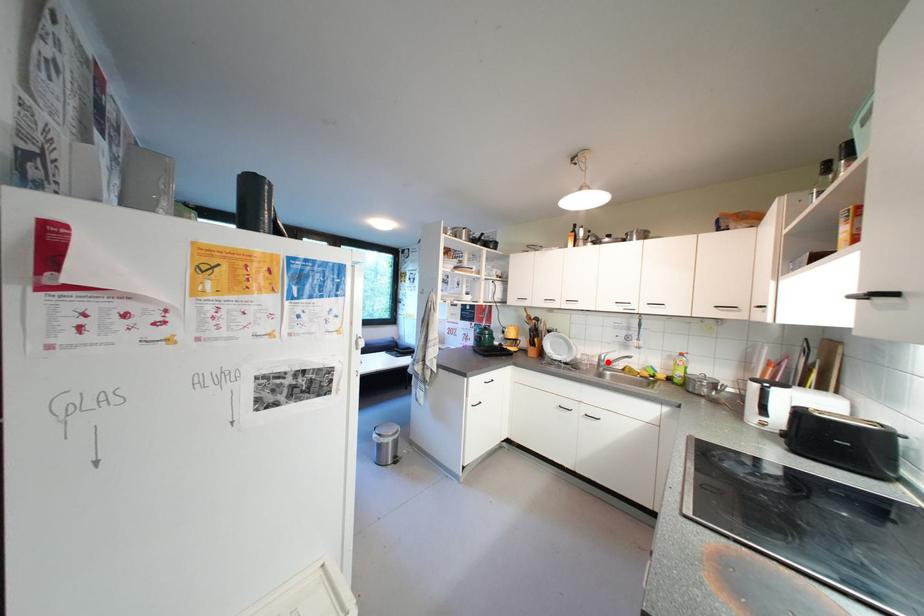
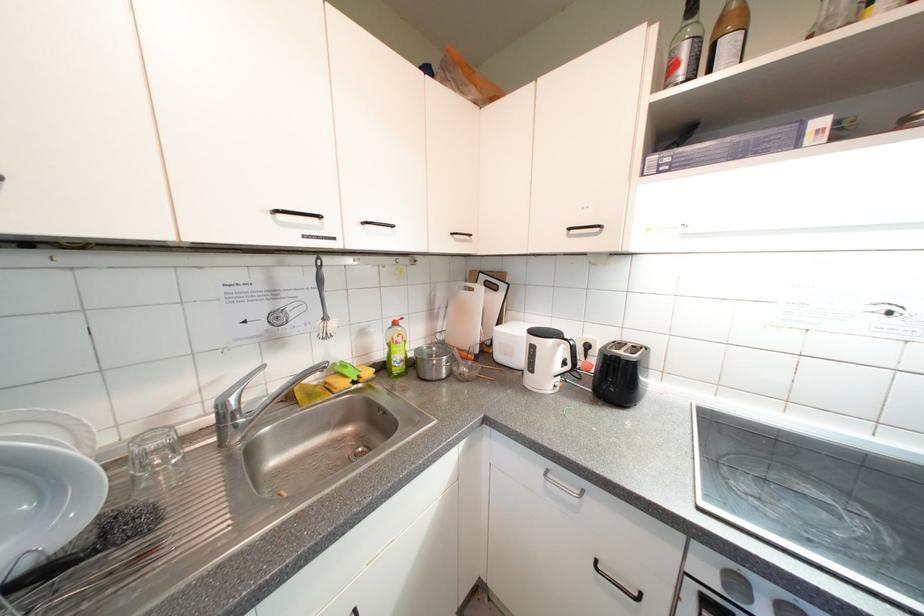
Where in the second image is the point corresponding to the highlighted location from the first image?

(233, 419)